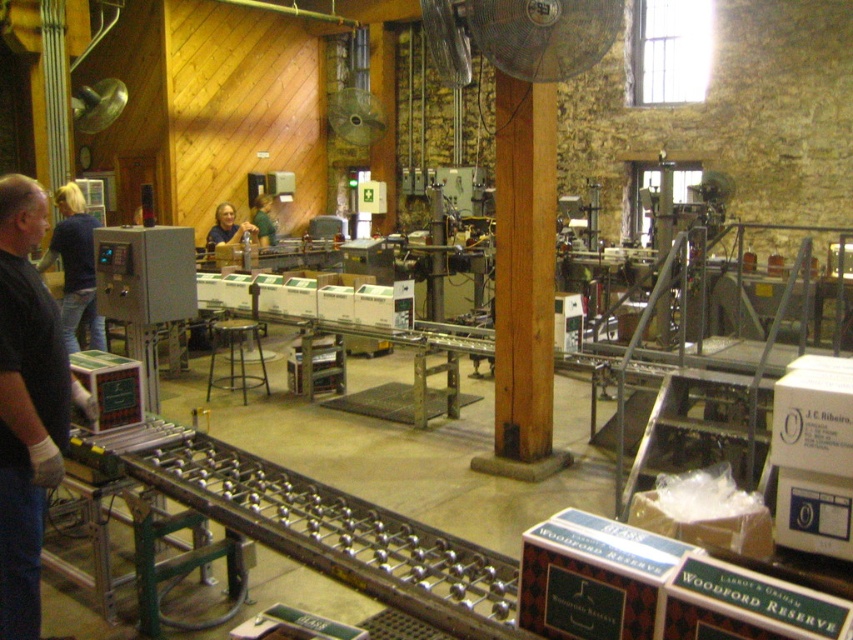
Question: Which of the following is the farthest from the observer?

Choices:
 (A) (231, 230)
 (B) (51, 237)
 (C) (263, 212)
 (D) (793, 396)

Answer: (C)

Question: From the image, what is the correct spatial relationship of white cardboard box at lower right in relation to green fabric shirt at center?

Choices:
 (A) above
 (B) below

Answer: (B)

Question: Which point is farther to the camera?

Choices:
 (A) (827, 403)
 (B) (274, 230)
 (C) (15, 288)

Answer: (B)

Question: Does white cardboard box at lower right have a smaller size compared to matte blue shirt at center?

Choices:
 (A) no
 (B) yes

Answer: (B)

Question: Among these points, which one is nearest to the camera?

Choices:
 (A) (51, 304)
 (B) (62, 246)

Answer: (A)

Question: Is the position of white cardboard box at lower right more distant than that of blue denim jeans at left?

Choices:
 (A) no
 (B) yes

Answer: (A)